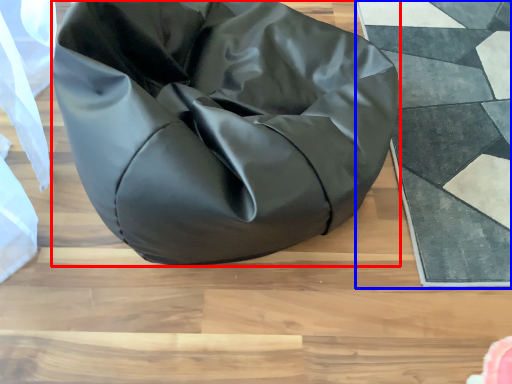
Question: Which of the following is the closest to the observer, furniture (highlighted by a red box) or mat (highlighted by a blue box)?

Choices:
 (A) furniture
 (B) mat

Answer: (A)